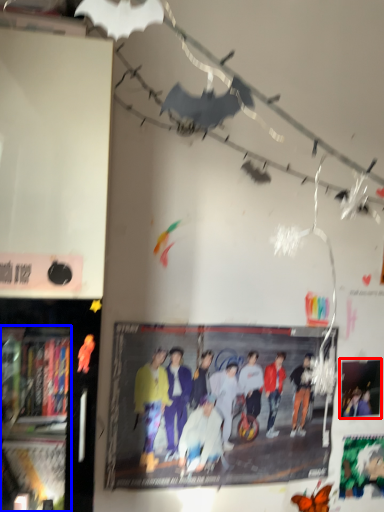
Question: Which of the following is the farthest to the observer, poster page (highlighted by a red box) or bookshelf (highlighted by a blue box)?

Choices:
 (A) poster page
 (B) bookshelf

Answer: (A)